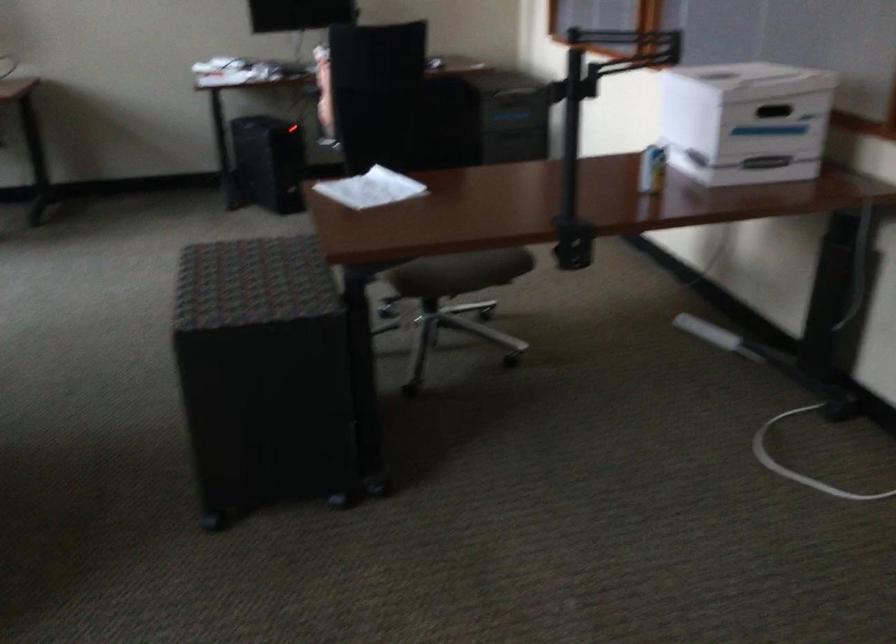
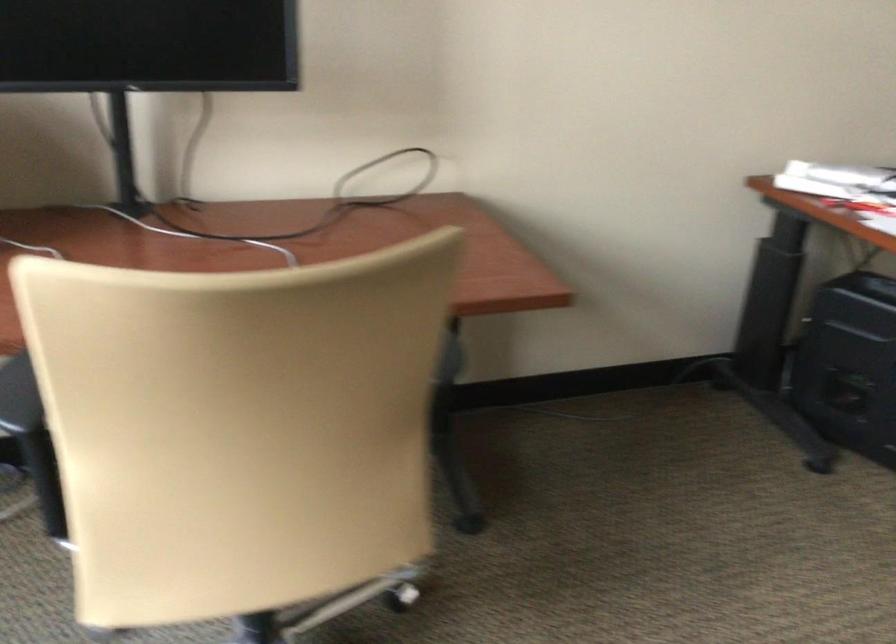
In a continuous first-person perspective shot, in which direction is the camera moving?

The cameraman moved toward left, forward.